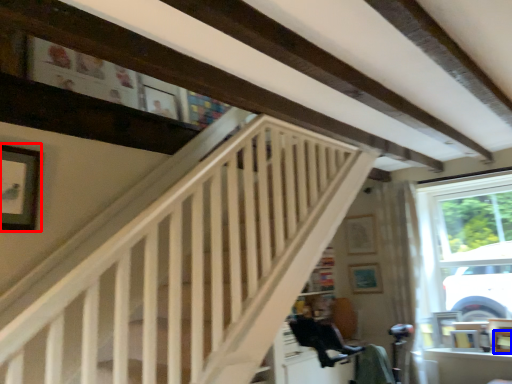
Question: Which object appears farthest to the camera in this image, picture frame (highlighted by a red box) or picture frame (highlighted by a blue box)?

Choices:
 (A) picture frame
 (B) picture frame

Answer: (B)